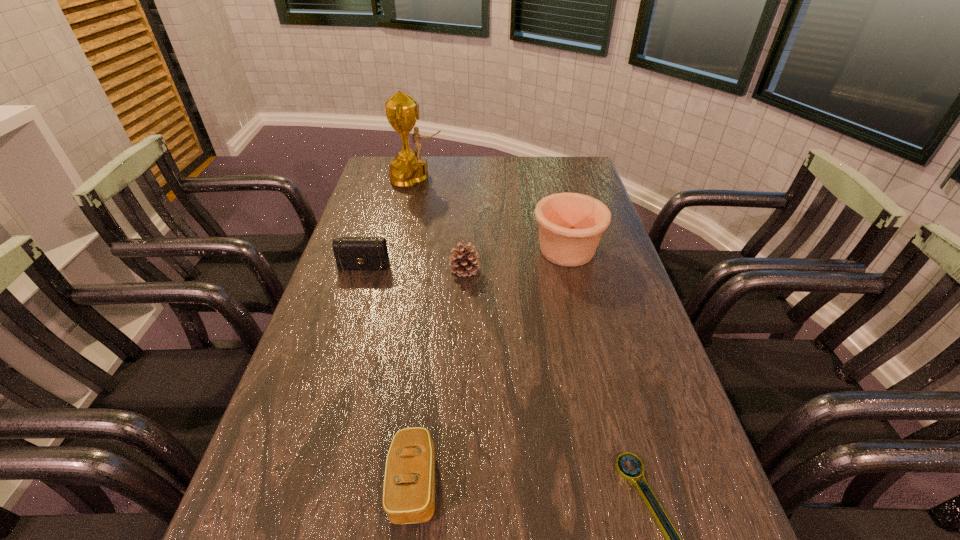
The height and width of the screenshot is (540, 960). In order to click on award in this screenshot , I will do pyautogui.click(x=408, y=169).

This screenshot has height=540, width=960. I want to click on the farthest object, so click(x=408, y=169).

This screenshot has width=960, height=540. What are the coordinates of `the second tallest object` in the screenshot? It's located at (570, 224).

Locate an element on the screen. This screenshot has height=540, width=960. pinecone is located at coordinates (464, 261).

In order to click on the taller clutch bag in this screenshot , I will do click(x=351, y=253).

Where is `the farther clutch bag`? the farther clutch bag is located at coordinates (351, 253).

You are a GUI agent. You are given a task and a screenshot of the screen. Output one action in this format:
    pyautogui.click(x=<x>, y=<y>)
    Task: Click on the second shortest object
    
    Given the screenshot: What is the action you would take?
    pyautogui.click(x=409, y=484)

At what (x,y) coordinates should I click in order to perform the action: click on the right clutch bag. Please return your answer as a coordinate pair (x, y). Looking at the image, I should click on (409, 484).

The width and height of the screenshot is (960, 540). Find the location of `free spot located 0.170m on the front side of the tallest object`. free spot located 0.170m on the front side of the tallest object is located at coordinates (491, 178).

The image size is (960, 540). What are the coordinates of `vacant space positioned on the front of the second tallest object` in the screenshot? It's located at (603, 397).